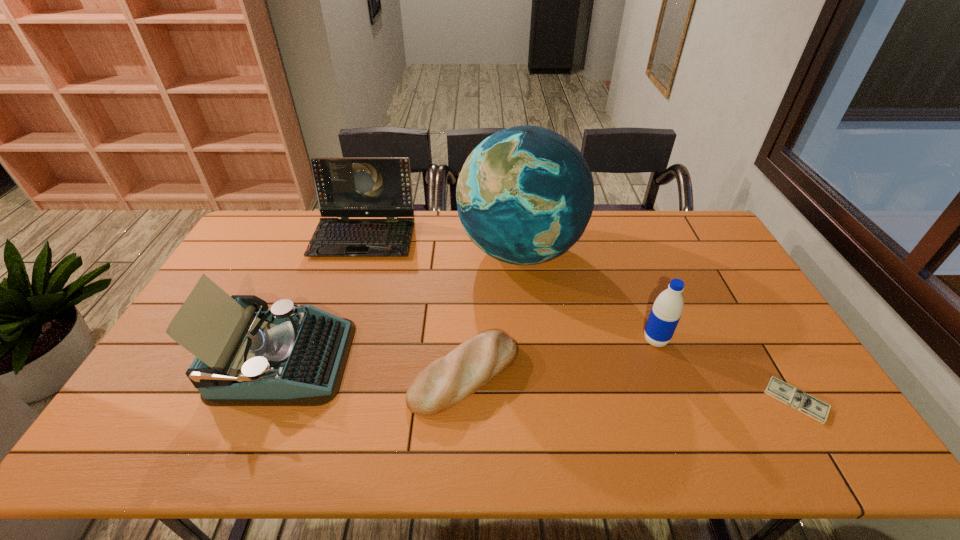
You are a GUI agent. You are given a task and a screenshot of the screen. Output one action in this format:
    pyautogui.click(x=<x>, y=<y>)
    Task: Click on the vacant region located 0.250m on the right of the water bottle
    The height and width of the screenshot is (540, 960).
    Given the screenshot: What is the action you would take?
    pyautogui.click(x=756, y=340)

You are a GUI agent. You are given a task and a screenshot of the screen. Output one action in this format:
    pyautogui.click(x=<x>, y=<y>)
    Task: Click on the vacant space located 0.260m on the right of the second shortest object
    
    Given the screenshot: What is the action you would take?
    pyautogui.click(x=617, y=374)

Where is `free space located on the back of the dollar`? The image size is (960, 540). free space located on the back of the dollar is located at coordinates (764, 348).

Image resolution: width=960 pixels, height=540 pixels. I want to click on globe located at the far edge, so click(x=525, y=194).

Find the location of a particular element. The image size is (960, 540). laptop computer situated at the far edge is located at coordinates (346, 187).

Find the location of a particular element. The height and width of the screenshot is (540, 960). object situated at the near edge is located at coordinates (803, 402).

In order to click on object positioned at the left edge in this screenshot , I will do `click(292, 355)`.

Identify the location of object at the right edge. The height and width of the screenshot is (540, 960). (803, 402).

At what (x,y) coordinates should I click in order to perform the action: click on object that is positioned at the near right corner. Please return your answer as a coordinate pair (x, y). This screenshot has width=960, height=540. Looking at the image, I should click on (803, 402).

Image resolution: width=960 pixels, height=540 pixels. In order to click on free space at the far edge of the desktop in this screenshot , I will do `click(642, 224)`.